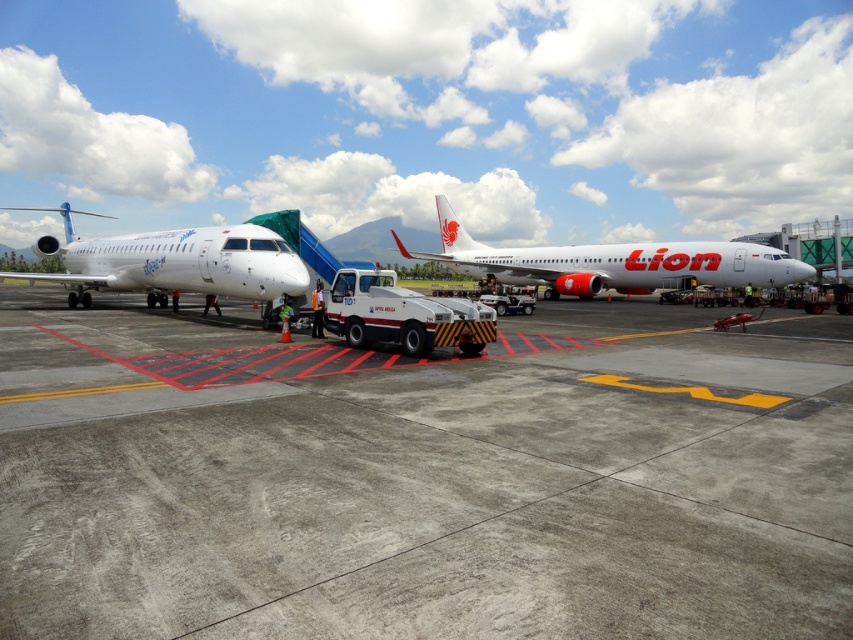
Question: Which object is farther from the camera taking this photo?

Choices:
 (A) gray concrete tarmac at center
 (B) white matte airplane at center

Answer: (B)

Question: Can you confirm if gray concrete tarmac at center is positioned to the left of white matte airplane at center?

Choices:
 (A) yes
 (B) no

Answer: (A)

Question: Which point is closer to the camera taking this photo?

Choices:
 (A) (20, 276)
 (B) (538, 250)
 (C) (254, 518)

Answer: (C)

Question: Estimate the real-world distances between objects in this image. Which object is closer to the white glossy airplane at left?

Choices:
 (A) white matte airplane at center
 (B) gray concrete tarmac at center

Answer: (B)

Question: Observing the image, what is the correct spatial positioning of gray concrete tarmac at center in reference to white matte airplane at center?

Choices:
 (A) right
 (B) left

Answer: (B)

Question: Observing the image, what is the correct spatial positioning of white glossy airplane at left in reference to white matte airplane at center?

Choices:
 (A) above
 (B) below

Answer: (B)